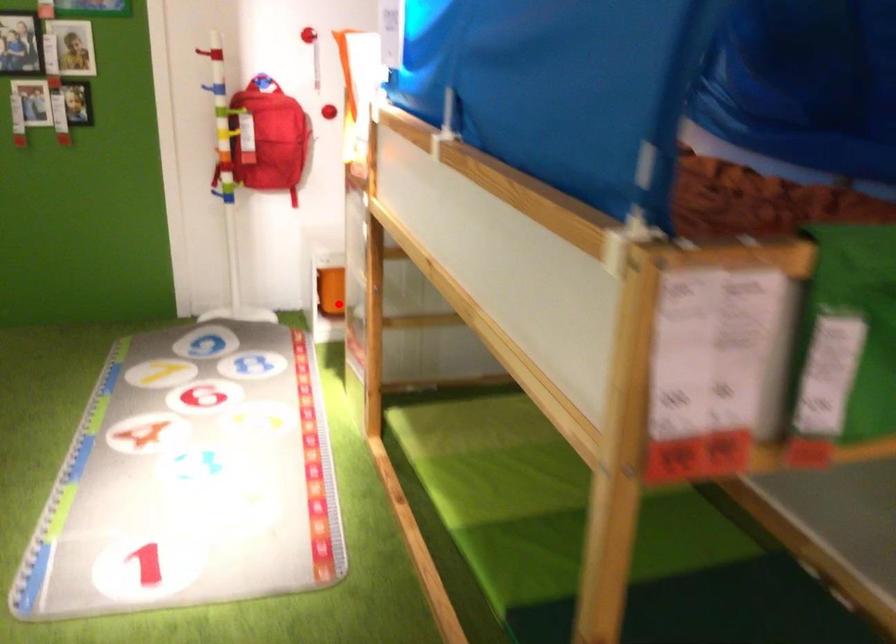
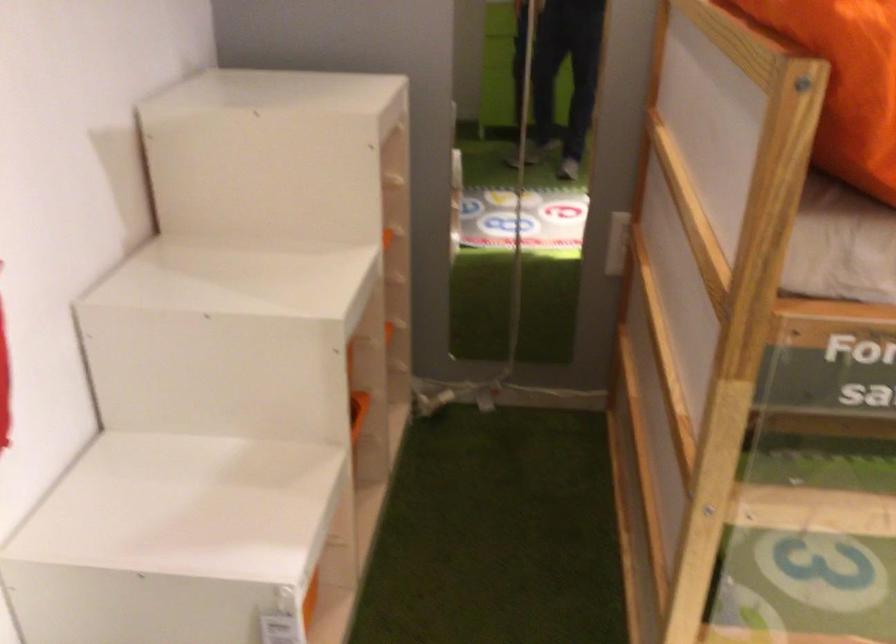
Where in the second image is the point corresponding to the highlighted location from the first image?

(309, 600)